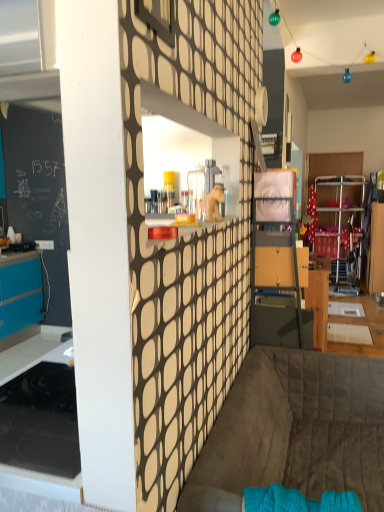
Question: Is dark gray quilted couch at lower center outside wooden drawer at center?

Choices:
 (A) no
 (B) yes

Answer: (B)

Question: Can you confirm if dark gray quilted couch at lower center is positioned to the right of wooden drawer at center?

Choices:
 (A) no
 (B) yes

Answer: (A)

Question: Are dark gray quilted couch at lower center and wooden drawer at center far apart?

Choices:
 (A) yes
 (B) no

Answer: (B)

Question: Is dark gray quilted couch at lower center smaller than wooden drawer at center?

Choices:
 (A) yes
 (B) no

Answer: (B)

Question: Can you confirm if dark gray quilted couch at lower center is positioned to the left of wooden drawer at center?

Choices:
 (A) yes
 (B) no

Answer: (A)

Question: Does dark gray quilted couch at lower center have a lesser height compared to wooden drawer at center?

Choices:
 (A) no
 (B) yes

Answer: (A)

Question: Is wooden drawer at center not inside dark gray quilted couch at lower center?

Choices:
 (A) no
 (B) yes

Answer: (B)

Question: Does wooden drawer at center have a greater height compared to dark gray quilted couch at lower center?

Choices:
 (A) no
 (B) yes

Answer: (A)

Question: From a real-world perspective, is wooden drawer at center located higher than dark gray quilted couch at lower center?

Choices:
 (A) yes
 (B) no

Answer: (A)

Question: Can you confirm if wooden drawer at center is shorter than dark gray quilted couch at lower center?

Choices:
 (A) no
 (B) yes

Answer: (B)

Question: Is wooden drawer at center oriented away from dark gray quilted couch at lower center?

Choices:
 (A) no
 (B) yes

Answer: (A)

Question: From the image's perspective, would you say wooden drawer at center is positioned over dark gray quilted couch at lower center?

Choices:
 (A) no
 (B) yes

Answer: (B)

Question: Considering the relative sizes of matte glass window at upper center and wooden drawer at center in the image provided, is matte glass window at upper center smaller than wooden drawer at center?

Choices:
 (A) yes
 (B) no

Answer: (A)